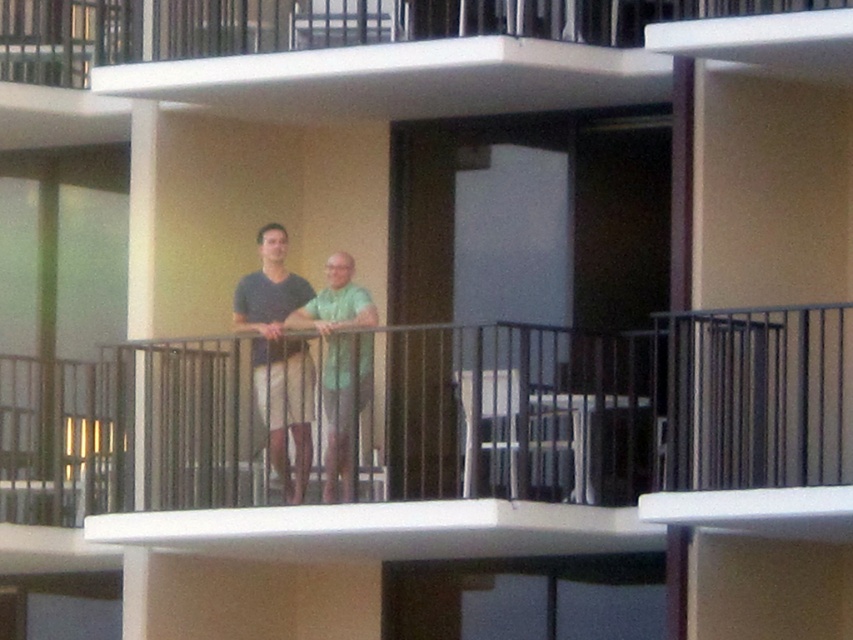
Is point (212, 36) behind point (338, 275)?

Yes, it is.

Between white concrete balcony at upper center and matte green shirt at center, which one is positioned higher?

white concrete balcony at upper center

Between point (131, 3) and point (331, 397), which one is positioned in front?

Positioned in front is point (331, 397).

In order to click on white concrete balcony at upper center in this screenshot , I will do `click(316, 26)`.